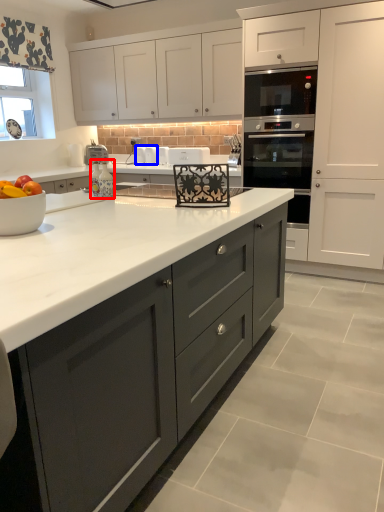
Question: Among these objects, which one is farthest to the camera, appliance (highlighted by a red box) or appliance (highlighted by a blue box)?

Choices:
 (A) appliance
 (B) appliance

Answer: (B)